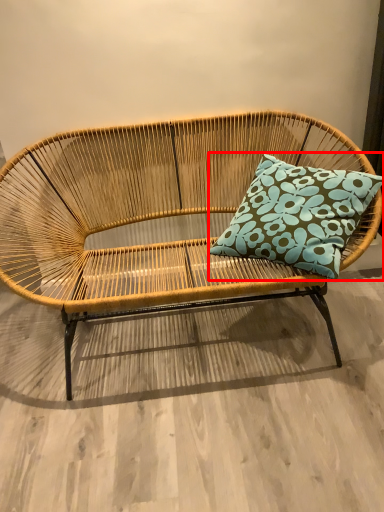
Question: From the image's perspective, considering the relative positions of pillow (annotated by the red box) and studio couch in the image provided, where is pillow (annotated by the red box) located with respect to the staircase?

Choices:
 (A) below
 (B) above

Answer: (B)